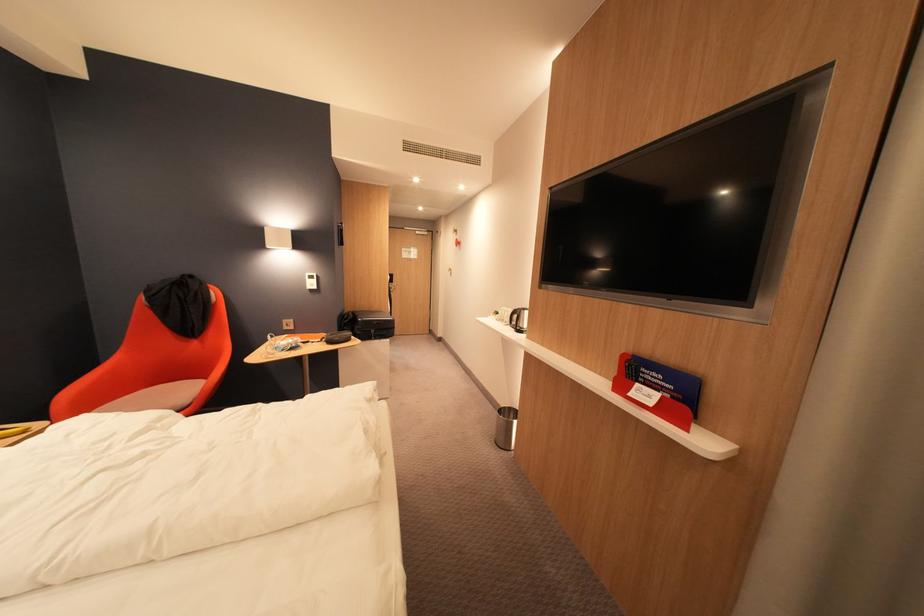
Find where to lift the black electric kettle. Please return your answer as a coordinate pair (x, y).

(518, 320)